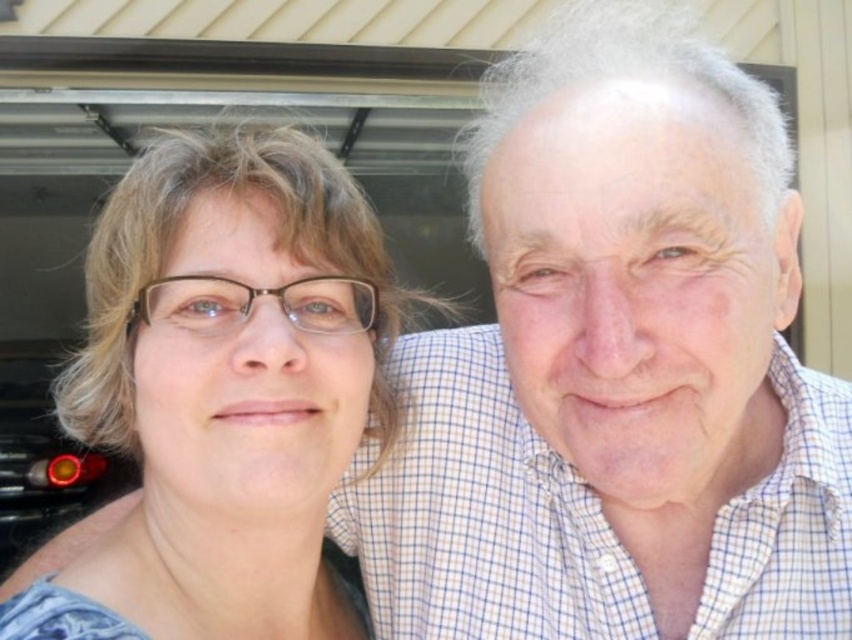
Looking at this image, you are a photographer trying to capture a photo of the matte blue shirt at center and the matte red taillight at lower left. Which object is located to the right of the other?

The matte blue shirt at center is positioned on the right side of the matte red taillight at lower left.

Based on the scene description, how far apart are the two individuals wearing the matte blue shirt at center and the checkered shirt with small squares?

The two individuals are 19.20 inches apart.

Based on the scene description, which object is taller between the matte blue shirt at center and the matte red taillight at lower left?

The matte red taillight at lower left is taller than the matte blue shirt at center.